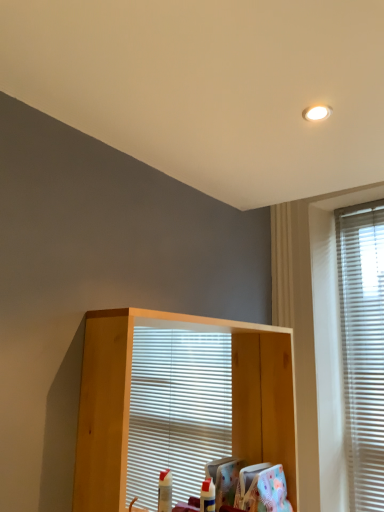
Question: Based on their sizes in the image, would you say light wood shelf at center is bigger or smaller than white blinds at right?

Choices:
 (A) big
 (B) small

Answer: (A)

Question: From the image's perspective, relative to white blinds at right, is light wood shelf at center above or below?

Choices:
 (A) above
 (B) below

Answer: (B)

Question: Do you think light wood shelf at center is within white blinds at right, or outside of it?

Choices:
 (A) outside
 (B) inside

Answer: (A)

Question: Is white blinds at right wider or thinner than light wood shelf at center?

Choices:
 (A) thin
 (B) wide

Answer: (A)

Question: From the image's perspective, relative to light wood shelf at center, is white blinds at right above or below?

Choices:
 (A) above
 (B) below

Answer: (A)

Question: Is white blinds at right bigger or smaller than light wood shelf at center?

Choices:
 (A) big
 (B) small

Answer: (B)

Question: In the image, is white blinds at right on the left side or the right side of light wood shelf at center?

Choices:
 (A) left
 (B) right

Answer: (B)